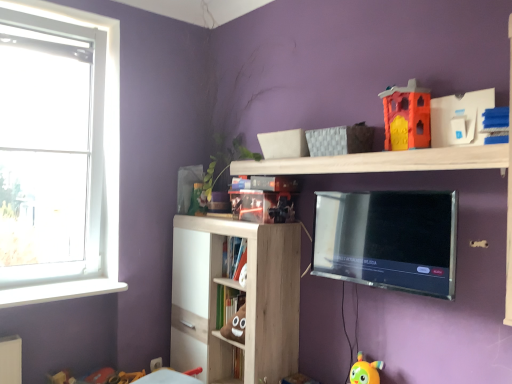
Find the location of `white matte bookshelf at center, which ranks as the 3th book in top-to-bottom order`. white matte bookshelf at center, which ranks as the 3th book in top-to-bottom order is located at coordinates (227, 303).

This screenshot has height=384, width=512. I want to click on light wood bookshelf at center, the second shelf in the top-to-bottom sequence, so click(x=236, y=290).

Image resolution: width=512 pixels, height=384 pixels. Identify the location of satin black tv at upper center. (388, 239).

The width and height of the screenshot is (512, 384). What do you see at coordinates (384, 161) in the screenshot?
I see `wooden shelf at upper center, the 1th shelf when ordered from top to bottom` at bounding box center [384, 161].

Where is `white matte bookshelf at center, which ranks as the 3th book in top-to-bottom order`? This screenshot has width=512, height=384. white matte bookshelf at center, which ranks as the 3th book in top-to-bottom order is located at coordinates (227, 303).

This screenshot has height=384, width=512. In order to click on television lying on the right of wooden shelf at upper center, the 1th shelf when ordered from top to bottom in this screenshot , I will do `click(388, 239)`.

From the image's perspective, is satin black tv at upper center above or below wooden shelf at upper center, placed as the second shelf when sorted from bottom to top?

Clearly, from the image's perspective, satin black tv at upper center is below wooden shelf at upper center, placed as the second shelf when sorted from bottom to top.

Based on the photo, can you confirm if satin black tv at upper center is bigger than wooden shelf at upper center, placed as the second shelf when sorted from bottom to top?

Indeed, satin black tv at upper center has a larger size compared to wooden shelf at upper center, placed as the second shelf when sorted from bottom to top.

From a real-world perspective, does satin black tv at upper center stand above wooden shelf at upper center, placed as the second shelf when sorted from bottom to top?

Incorrect, from a real-world perspective, satin black tv at upper center is lower than wooden shelf at upper center, placed as the second shelf when sorted from bottom to top.

Is point (340, 246) positioned before point (231, 304)?

Yes.

Which object is further away from the camera, satin black tv at upper center or white matte bookshelf at center, which ranks as the 3th book in top-to-bottom order?

white matte bookshelf at center, which ranks as the 3th book in top-to-bottom order, is further away from the camera.

Where is `television in front of the white matte bookshelf at center, which ranks as the 1th book in bottom-to-top order`? The image size is (512, 384). television in front of the white matte bookshelf at center, which ranks as the 1th book in bottom-to-top order is located at coordinates (388, 239).

From a real-world perspective, is rubber duck at lower center, the first toy in the bottom-to-top sequence, positioned under hardcover book at center, the 2th book from the bottom, based on gravity?

Correct, in the physical world, rubber duck at lower center, the first toy in the bottom-to-top sequence, is lower than hardcover book at center, the 2th book from the bottom.

Is point (365, 363) closer to camera compared to point (241, 242)?

Yes.

Image resolution: width=512 pixels, height=384 pixels. In the image, there is a hardcover book at center, the 2th book from the bottom. Find the location of `toy below it (from a real-world perspective)`. toy below it (from a real-world perspective) is located at coordinates (365, 371).

From the image's perspective, is rubber duck at lower center, marked as the 2th toy in a top-to-bottom arrangement, positioned above or below hardcover book at center, the 2th book from the bottom?

Clearly, from the image's perspective, rubber duck at lower center, marked as the 2th toy in a top-to-bottom arrangement, is below hardcover book at center, the 2th book from the bottom.

How many degrees apart are the facing directions of white glossy window sill at lower left and white plastic window at left?

The facing directions of white glossy window sill at lower left and white plastic window at left are 0.000767 degrees apart.

Considering the relative sizes of white glossy window sill at lower left and white plastic window at left in the image provided, is white glossy window sill at lower left thinner than white plastic window at left?

Incorrect, the width of white glossy window sill at lower left is not less than that of white plastic window at left.

Does white glossy window sill at lower left touch white plastic window at left?

They are not placed beside each other.

How far apart are white glossy window sill at lower left and white plastic window at left?

13.51 inches.

From a real-world perspective, is wooden shelf at upper center, the 1th shelf when ordered from top to bottom, positioned above or below rubber duck at lower center, marked as the 2th toy in a top-to-bottom arrangement?

Clearly, from a real-world perspective, wooden shelf at upper center, the 1th shelf when ordered from top to bottom, is above rubber duck at lower center, marked as the 2th toy in a top-to-bottom arrangement.

Considering the sizes of objects wooden shelf at upper center, placed as the second shelf when sorted from bottom to top, and rubber duck at lower center, marked as the 2th toy in a top-to-bottom arrangement, in the image provided, who is thinner, wooden shelf at upper center, placed as the second shelf when sorted from bottom to top, or rubber duck at lower center, marked as the 2th toy in a top-to-bottom arrangement,?

rubber duck at lower center, marked as the 2th toy in a top-to-bottom arrangement.

Image resolution: width=512 pixels, height=384 pixels. I want to click on shelf in front of the rubber duck at lower center, marked as the 2th toy in a top-to-bottom arrangement, so click(x=384, y=161).

Is point (459, 151) closer or farther from the camera than point (375, 370)?

Point (459, 151) is positioned closer to the camera compared to point (375, 370).

Can you confirm if white glossy window sill at lower left is taller than hardcover book at center, the second book in the top-to-bottom sequence?

Incorrect, the height of white glossy window sill at lower left is not larger of that of hardcover book at center, the second book in the top-to-bottom sequence.

Which is in front, point (22, 303) or point (237, 252)?

Positioned in front is point (22, 303).

Looking at this image, is hardcover book at center, the second book in the top-to-bottom sequence, at the back of white glossy window sill at lower left?

white glossy window sill at lower left is not turned away from hardcover book at center, the second book in the top-to-bottom sequence.

Find the location of a particular element. window that appears above the satin black tv at upper center (from the image's perspective) is located at coordinates (90, 174).

Considering the positions of points (384, 226) and (76, 296), is point (384, 226) farther from camera compared to point (76, 296)?

No, it is in front of (76, 296).

How many degrees apart are the facing directions of satin black tv at upper center and white plastic window at left?

The facing directions of satin black tv at upper center and white plastic window at left are 88.9 degrees apart.

Is there a large distance between satin black tv at upper center and white plastic window at left?

Yes, satin black tv at upper center and white plastic window at left are located far from each other.

At what (x,y) coordinates should I click in order to perform the action: click on television that is behind the wooden shelf at upper center, the 1th shelf when ordered from top to bottom. Please return your answer as a coordinate pair (x, y). Looking at the image, I should click on (388, 239).

From a real-world perspective, starting from the satin black tv at upper center, which book is the 2nd one below it? Please provide its 2D coordinates.

[(227, 303)]

Looking at this image, when comparing their distances from wooden shelf at upper center, placed as the second shelf when sorted from bottom to top, does white plastic window at left or white matte bookshelf at center, which ranks as the 3th book in top-to-bottom order, seem further?

Among the two, white plastic window at left is located further to wooden shelf at upper center, placed as the second shelf when sorted from bottom to top.

Which object lies nearer to the anchor point light wood bookshelf at center, the second shelf in the top-to-bottom sequence, hardcover book at center, the 2th book from the bottom, or white matte bookshelf at center, which ranks as the 1th book in bottom-to-top order?

white matte bookshelf at center, which ranks as the 1th book in bottom-to-top order, is closer to light wood bookshelf at center, the second shelf in the top-to-bottom sequence.

Consider the image. Based on their spatial positions, is rubber duck at lower center, the first toy in the bottom-to-top sequence, or light wood bookshelf at center, the 1th shelf when ordered from bottom to top, further from satin black tv at upper center?

Based on the image, light wood bookshelf at center, the 1th shelf when ordered from bottom to top, appears to be further to satin black tv at upper center.

Which object lies nearer to the anchor point white matte bookshelf at center, which ranks as the 3th book in top-to-bottom order, rubber duck at lower center, the first toy in the bottom-to-top sequence, or white plastic window at left?

rubber duck at lower center, the first toy in the bottom-to-top sequence, lies closer to white matte bookshelf at center, which ranks as the 3th book in top-to-bottom order, than the other object.

Estimate the real-world distances between objects in this image. Which object is further from white matte bookshelf at center, which ranks as the 3th book in top-to-bottom order, glossy plastic bookshelf at upper center, which is the first book in top-to-bottom order, or satin black tv at upper center?

satin black tv at upper center is further to white matte bookshelf at center, which ranks as the 3th book in top-to-bottom order.

From the picture: Estimate the real-world distances between objects in this image. Which object is closer to white matte bookshelf at center, which ranks as the 1th book in bottom-to-top order, white plastic window at left or white glossy window sill at lower left?

white glossy window sill at lower left is closer to white matte bookshelf at center, which ranks as the 1th book in bottom-to-top order.

Which object lies further to the anchor point hardcover book at center, the second book in the top-to-bottom sequence, white glossy window sill at lower left or white matte bookshelf at center, which ranks as the 3th book in top-to-bottom order?

white glossy window sill at lower left.

When comparing their distances from light wood bookshelf at center, the 1th shelf when ordered from bottom to top, does white matte bookshelf at center, which ranks as the 3th book in top-to-bottom order, or orange matte plastic castle at upper right, the second toy from the bottom, seem closer?

Based on the image, white matte bookshelf at center, which ranks as the 3th book in top-to-bottom order, appears to be nearer to light wood bookshelf at center, the 1th shelf when ordered from bottom to top.

Locate an element on the screen. shelf located between white plastic window at left and white matte bookshelf at center, which ranks as the 3th book in top-to-bottom order, in the left-right direction is located at coordinates (236, 290).

Where is `toy located between white glossy window sill at lower left and orange matte plastic castle at upper right, the 1th toy positioned from the top, in the left-right direction`? The height and width of the screenshot is (384, 512). toy located between white glossy window sill at lower left and orange matte plastic castle at upper right, the 1th toy positioned from the top, in the left-right direction is located at coordinates (365, 371).

Find the location of a particular element. shelf that lies between orange matte plastic castle at upper right, the 1th toy positioned from the top, and light wood bookshelf at center, the 1th shelf when ordered from bottom to top, from top to bottom is located at coordinates (384, 161).

Find the location of a particular element. The height and width of the screenshot is (384, 512). window sill situated between white plastic window at left and glossy plastic bookshelf at upper center, the third book in the bottom-to-top sequence, from left to right is located at coordinates coord(59,291).